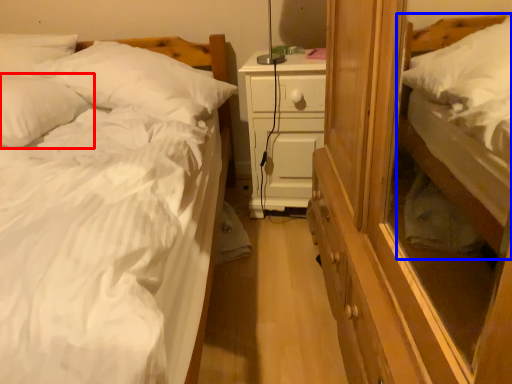
Question: Among these objects, which one is nearest to the camera, pillow (highlighted by a red box) or bed (highlighted by a blue box)?

Choices:
 (A) pillow
 (B) bed

Answer: (A)